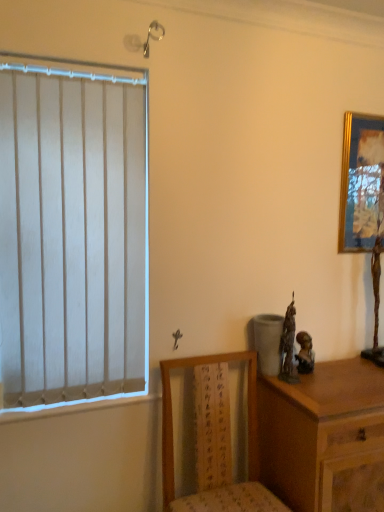
Question: Is gold-framed picture at upper right outside wooden chair at lower center?

Choices:
 (A) no
 (B) yes

Answer: (B)

Question: From the image's perspective, does gold-framed picture at upper right appear higher than wooden chair at lower center?

Choices:
 (A) yes
 (B) no

Answer: (A)

Question: Is gold-framed picture at upper right surrounding wooden chair at lower center?

Choices:
 (A) yes
 (B) no

Answer: (B)

Question: Is gold-framed picture at upper right shorter than wooden chair at lower center?

Choices:
 (A) no
 (B) yes

Answer: (B)

Question: From a real-world perspective, is gold-framed picture at upper right over wooden chair at lower center?

Choices:
 (A) no
 (B) yes

Answer: (B)

Question: Is gold-framed picture at upper right to the left of wooden chair at lower center from the viewer's perspective?

Choices:
 (A) yes
 (B) no

Answer: (B)

Question: From the image's perspective, is gold-framed picture at upper right on top of wooden chest of drawers at right?

Choices:
 (A) yes
 (B) no

Answer: (A)

Question: Is gold-framed picture at upper right bigger than wooden chest of drawers at right?

Choices:
 (A) yes
 (B) no

Answer: (B)

Question: Is gold-framed picture at upper right at the right side of wooden chest of drawers at right?

Choices:
 (A) yes
 (B) no

Answer: (A)

Question: Is gold-framed picture at upper right far away from wooden chest of drawers at right?

Choices:
 (A) no
 (B) yes

Answer: (A)

Question: Is wooden chest of drawers at right surrounded by gold-framed picture at upper right?

Choices:
 (A) yes
 (B) no

Answer: (B)

Question: Is gold-framed picture at upper right positioned with its back to wooden chest of drawers at right?

Choices:
 (A) no
 (B) yes

Answer: (A)

Question: Does wooden chair at lower center have a greater height compared to wooden chest of drawers at right?

Choices:
 (A) yes
 (B) no

Answer: (B)